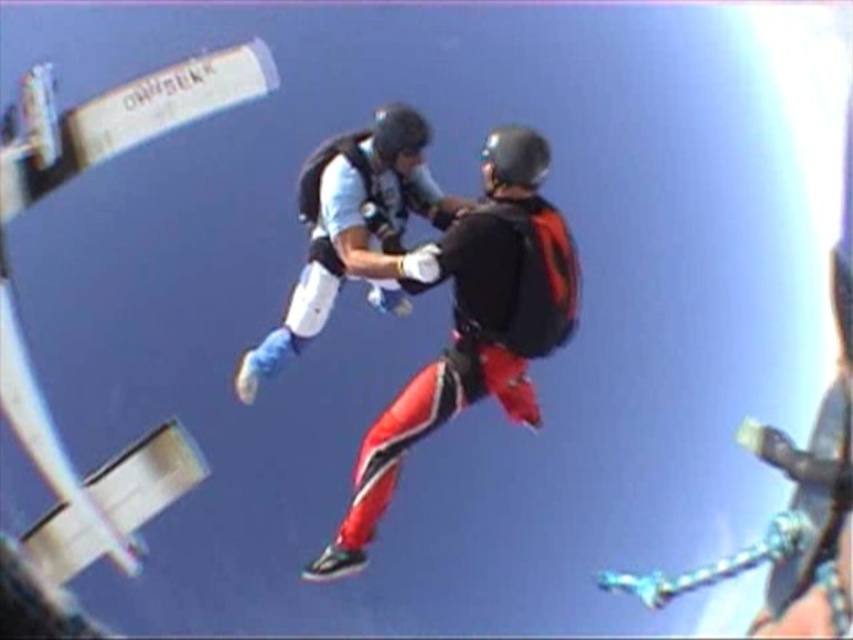
Which is below, red and black ski suit at center or matte white suit at center?

Positioned lower is red and black ski suit at center.

Can you confirm if red and black ski suit at center is shorter than matte white suit at center?

No.

Find the location of a particular element. red and black ski suit at center is located at coordinates (473, 324).